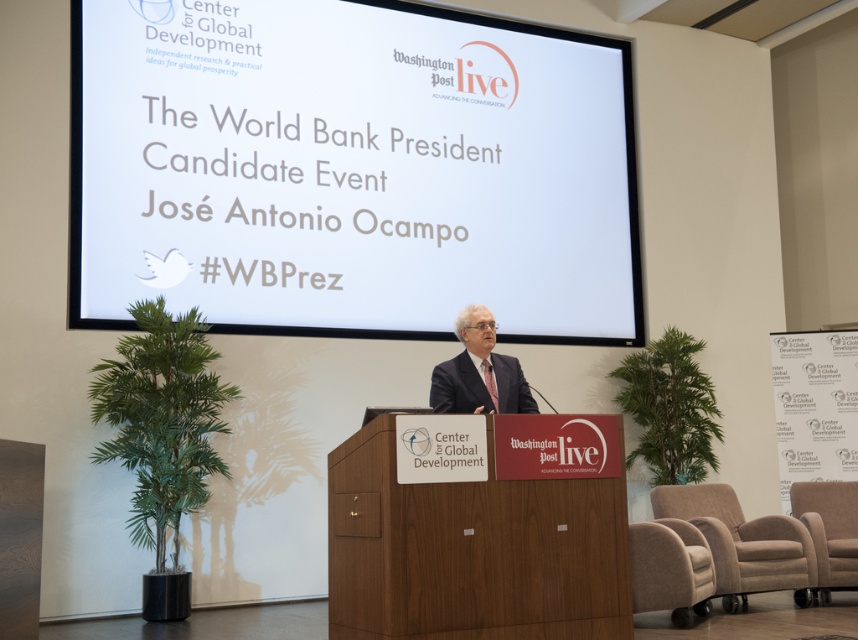
The width and height of the screenshot is (858, 640). Find the location of `white matte projection screen at upper center`. white matte projection screen at upper center is located at coordinates (349, 170).

The height and width of the screenshot is (640, 858). What do you see at coordinates (349, 170) in the screenshot?
I see `white matte projection screen at upper center` at bounding box center [349, 170].

Is point (113, 273) in front of point (663, 600)?

No, (113, 273) is behind (663, 600).

Locate an element on the screen. white matte projection screen at upper center is located at coordinates (349, 170).

Can you confirm if dark suit at center is positioned below dark brown leather armchair at lower right?

No, dark suit at center is not below dark brown leather armchair at lower right.

Does point (470, 337) lie in front of point (855, 486)?

Yes, point (470, 337) is in front of point (855, 486).

The height and width of the screenshot is (640, 858). In order to click on dark suit at center in this screenshot , I will do `click(479, 371)`.

Can you confirm if wooden podium at center is smaller than dark suit at center?

No, wooden podium at center is not smaller than dark suit at center.

Does wooden podium at center have a greater height compared to dark suit at center?

Indeed, wooden podium at center has a greater height compared to dark suit at center.

Does point (536, 609) come behind point (454, 365)?

No, (536, 609) is closer to viewer.

At what (x,y) coordinates should I click in order to perform the action: click on wooden podium at center. Please return your answer as a coordinate pair (x, y). The width and height of the screenshot is (858, 640). Looking at the image, I should click on (472, 550).